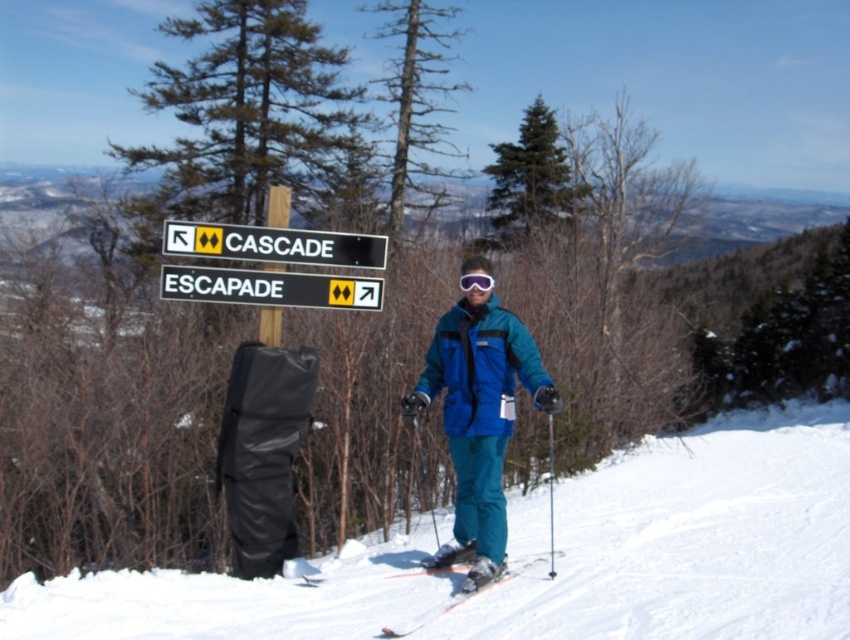
Which is more to the left, teal matte ski suit at center or shiny metallic skis at center?

teal matte ski suit at center is more to the left.

Measure the distance between point (507,349) and camera.

They are 21.14 feet apart.

Locate an element on the screen. Image resolution: width=850 pixels, height=640 pixels. teal matte ski suit at center is located at coordinates (479, 420).

Which of these two, black plastic sign at upper center or shiny metallic skis at center, stands taller?

black plastic sign at upper center is taller.

Which is behind, point (250, 248) or point (551, 577)?

Point (250, 248)

Describe the element at coordinates (275, 244) in the screenshot. I see `black plastic sign at upper center` at that location.

Locate an element on the screen. The image size is (850, 640). black plastic sign at upper center is located at coordinates (275, 244).

Does teal matte ski suit at center appear under purple matte goggles at center?

Correct, teal matte ski suit at center is located below purple matte goggles at center.

Is teal matte ski suit at center closer to camera compared to purple matte goggles at center?

Yes, it is in front of purple matte goggles at center.

The width and height of the screenshot is (850, 640). Identify the location of teal matte ski suit at center. (479, 420).

Find the location of a particular element. Image resolution: width=850 pixels, height=640 pixels. teal matte ski suit at center is located at coordinates (479, 420).